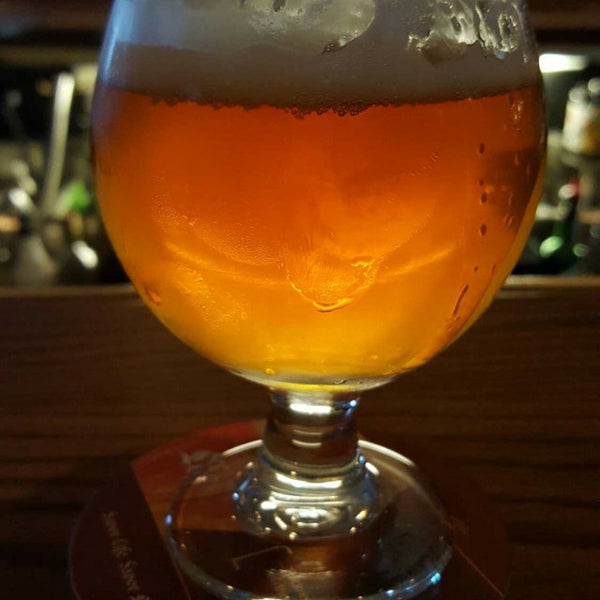
Find the location of a particular element. This screenshot has height=600, width=600. right back edge table is located at coordinates (553, 277).